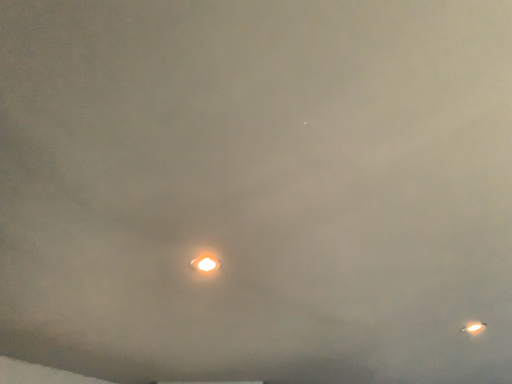
At what (x,y) coordinates should I click in order to perform the action: click on matte white light fixture at lower right. Please return your answer as a coordinate pair (x, y). Looking at the image, I should click on (474, 328).

The width and height of the screenshot is (512, 384). What do you see at coordinates (474, 328) in the screenshot?
I see `matte white light fixture at lower right` at bounding box center [474, 328].

This screenshot has width=512, height=384. I want to click on matte white light fixture at lower right, so click(474, 328).